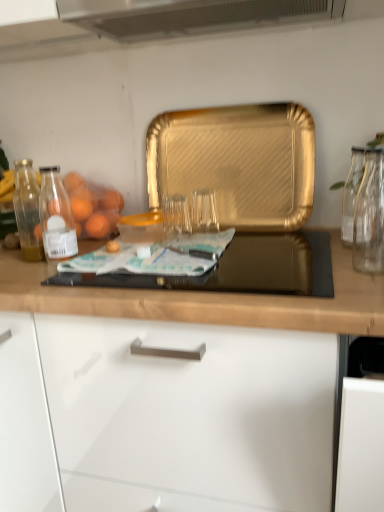
Find the location of a particular element. The image size is (384, 512). vacant area on top of gold textured tray at center (from a real-world perspective) is located at coordinates 232,105.